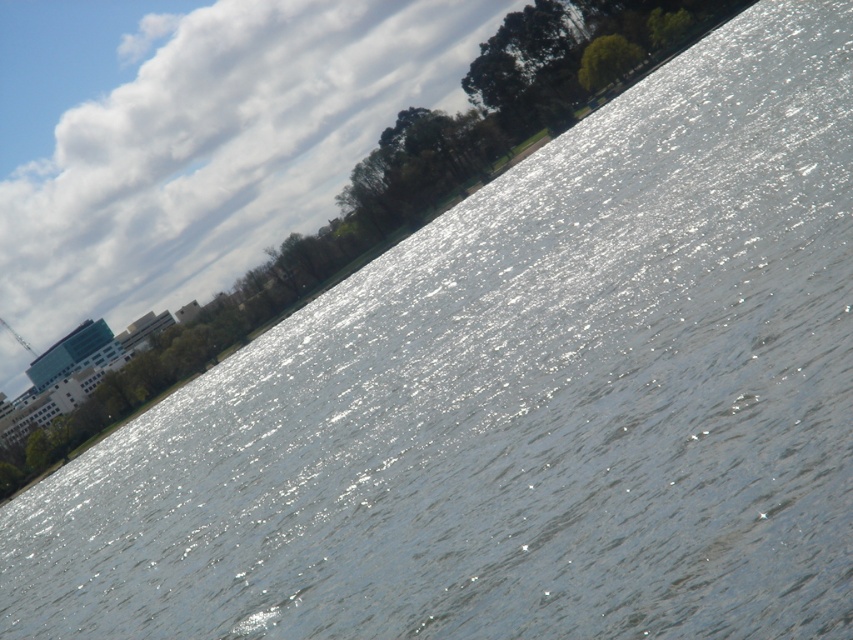
You are an architect designing a new building. You notice the white fluffy cloud at upper left and the green leafy tree at upper center in the image. Which object is positioned higher in the sky?

The white fluffy cloud at upper left has a greater height compared to the green leafy tree at upper center, so the white fluffy cloud at upper left is positioned higher in the sky.

You are an artist planning to paint the scene. You need to decide which object to paint first based on their sizes. Which one should you start with, the white fluffy cloud at upper left or the green leafy tree at upper center?

The white fluffy cloud at upper left is larger in size than the green leafy tree at upper center, so you should start painting the white fluffy cloud at upper left first because it requires more space and detail.